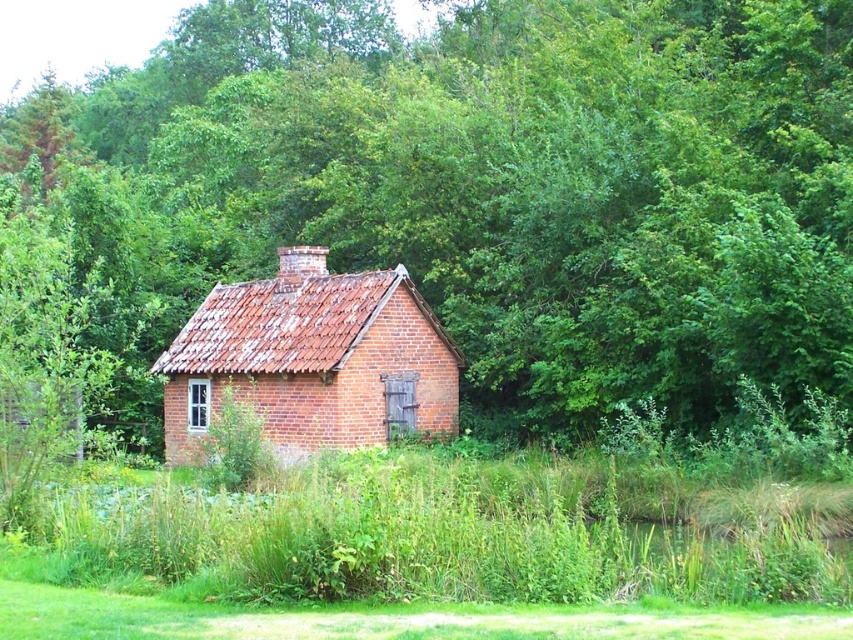
In the scene shown: You are planning to place a new garden bench in the scene. The bench requires a space wider than the red brick cottage at center. Can the green grass at center provide enough space for the bench?

The green grass at center is wider than the red brick cottage at center, so yes, the green grass at center can provide enough space for the bench since its width surpasses that of the red brick cottage at center.